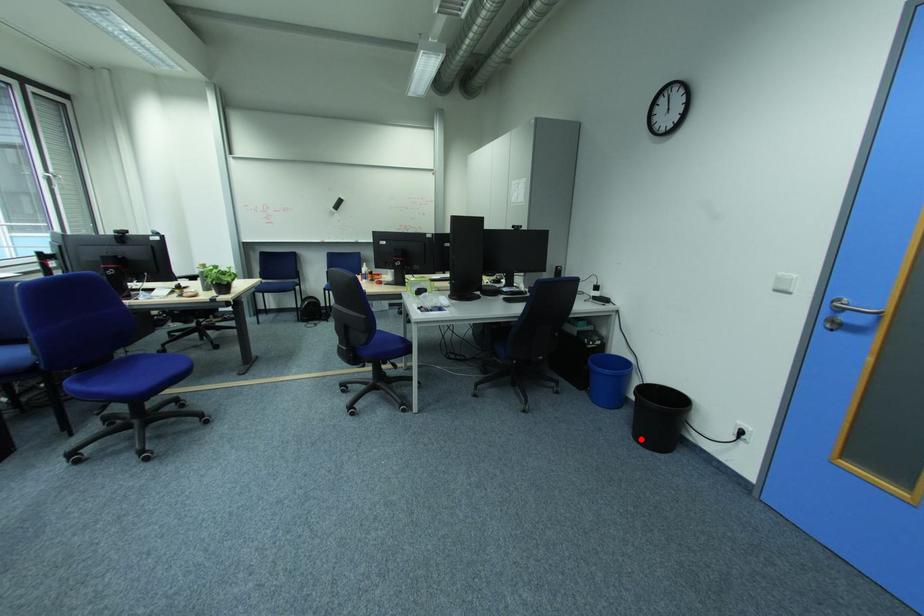
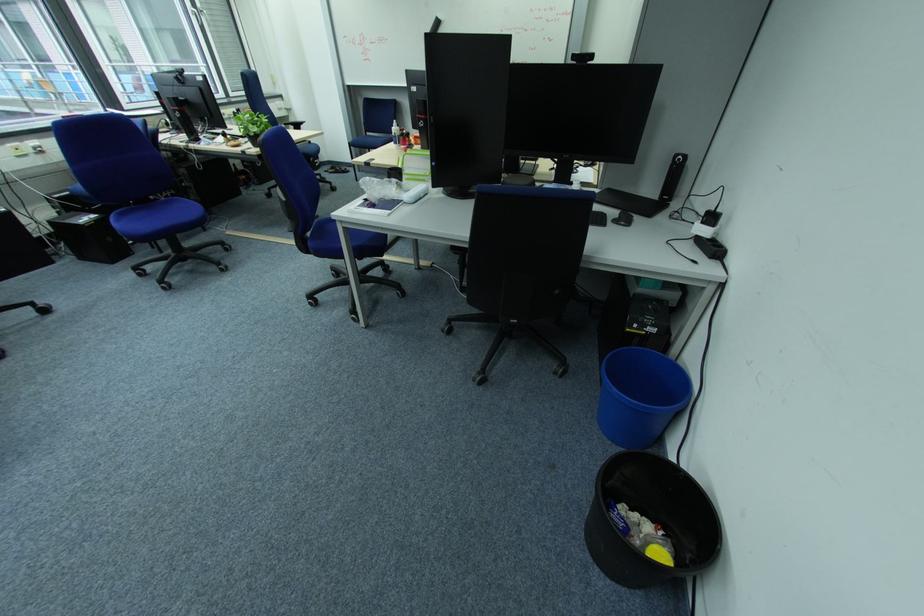
Question: I am providing you with two images of the same scene from different viewpoints. In image1, a red point is highlighted. Considering the same 3D point in image2, which of the following is correct?

Choices:
 (A) It is closer
 (B) It is farther

Answer: (B)